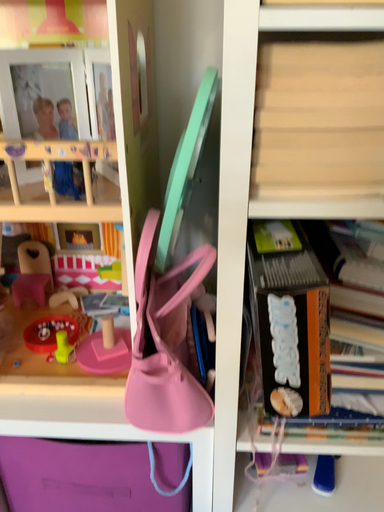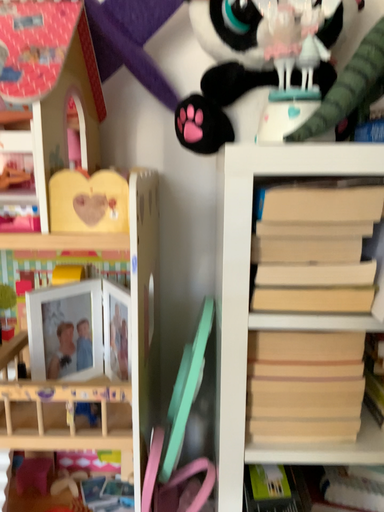
Question: How did the camera likely rotate when shooting the video?

Choices:
 (A) rotated downward
 (B) rotated upward

Answer: (B)